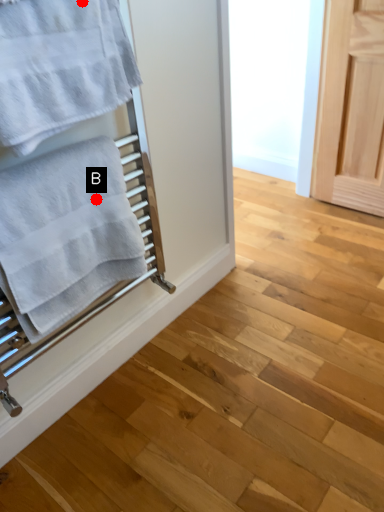
Question: Two points are circled on the image, labeled by A and B beside each circle. Which of the following is the farthest from the observer?

Choices:
 (A) A is further
 (B) B is further

Answer: (B)